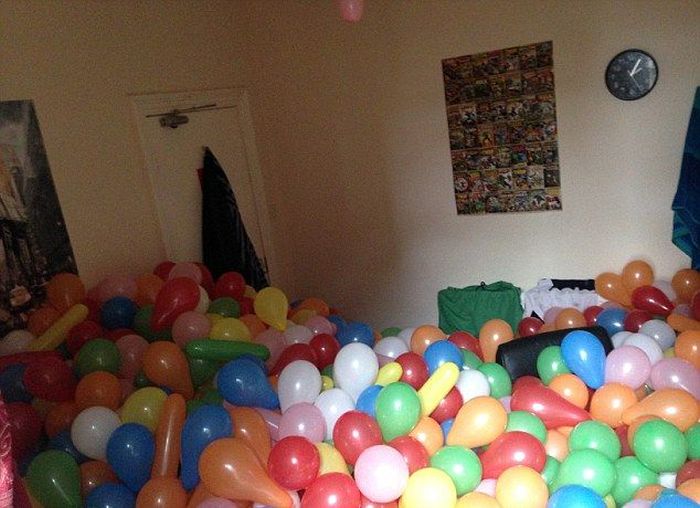
Where is `coat`? The image size is (700, 508). coat is located at coordinates (218, 227).